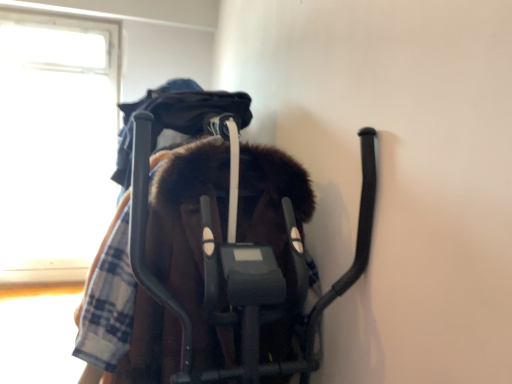
Question: In the image, is brown fuzzy coat at center positioned in front of or behind transparent glass window at upper left?

Choices:
 (A) front
 (B) behind

Answer: (A)

Question: Does point (251, 238) appear closer or farther from the camera than point (70, 150)?

Choices:
 (A) farther
 (B) closer

Answer: (B)

Question: Is brown fuzzy coat at center taller or shorter than transparent glass window at upper left?

Choices:
 (A) tall
 (B) short

Answer: (B)

Question: Based on their positions, is transparent glass window at upper left located to the left or right of brown fuzzy coat at center?

Choices:
 (A) right
 (B) left

Answer: (B)

Question: From a real-world perspective, relative to brown fuzzy coat at center, is transparent glass window at upper left vertically above or below?

Choices:
 (A) above
 (B) below

Answer: (A)

Question: Is transparent glass window at upper left in front of or behind brown fuzzy coat at center in the image?

Choices:
 (A) front
 (B) behind

Answer: (B)

Question: Considering the positions of point coord(18,120) and point coord(150,258), is point coord(18,120) closer or farther from the camera than point coord(150,258)?

Choices:
 (A) farther
 (B) closer

Answer: (A)